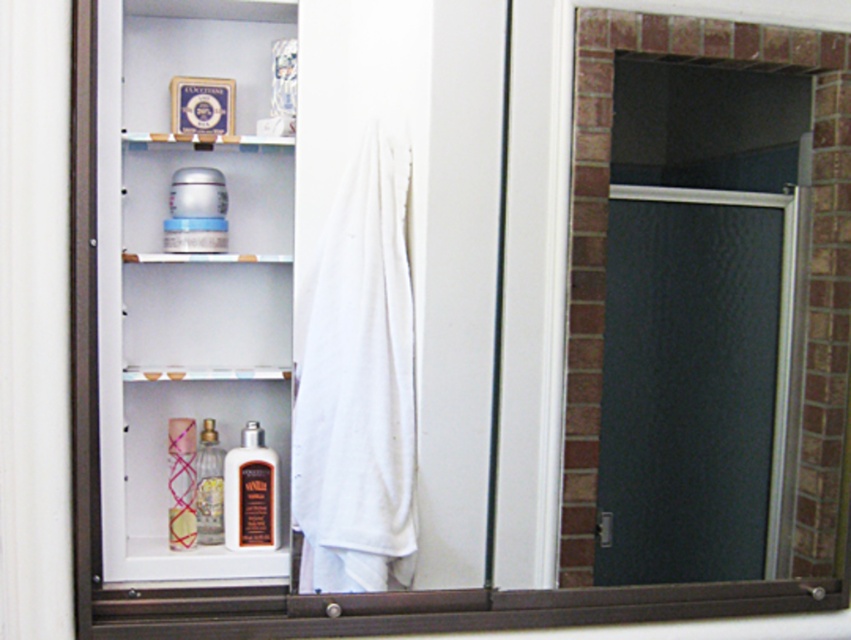
Can you confirm if white glossy cabinet at center is smaller than translucent glass bottles at center?

No, white glossy cabinet at center is not smaller than translucent glass bottles at center.

Identify the location of white glossy cabinet at center. (187, 275).

Where is `white glossy cabinet at center`? The width and height of the screenshot is (851, 640). white glossy cabinet at center is located at coordinates (187, 275).

Who is positioned more to the right, black mesh screen door at right or translucent pink glass tube at lower left?

Positioned to the right is black mesh screen door at right.

Is black mesh screen door at right smaller than translucent pink glass tube at lower left?

Actually, black mesh screen door at right might be larger than translucent pink glass tube at lower left.

At what (x,y) coordinates should I click in order to perform the action: click on black mesh screen door at right. Please return your answer as a coordinate pair (x, y). The height and width of the screenshot is (640, 851). Looking at the image, I should click on (695, 317).

Find the location of `black mesh screen door at right`. black mesh screen door at right is located at coordinates 695,317.

Does white glossy cabinet at center appear on the left side of brown matte lotion at center?

Correct, you'll find white glossy cabinet at center to the left of brown matte lotion at center.

Where is `white glossy cabinet at center`? The width and height of the screenshot is (851, 640). white glossy cabinet at center is located at coordinates (187, 275).